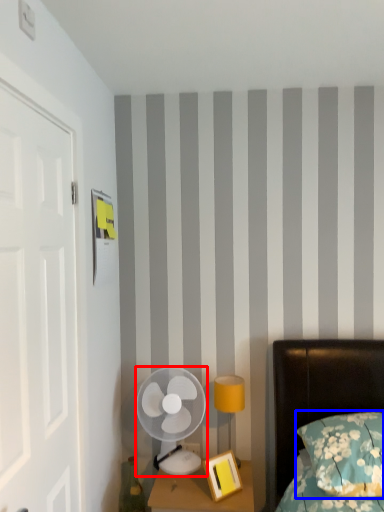
Question: Among these objects, which one is farthest to the camera, mechanical fan (highlighted by a red box) or pillow (highlighted by a blue box)?

Choices:
 (A) mechanical fan
 (B) pillow

Answer: (A)